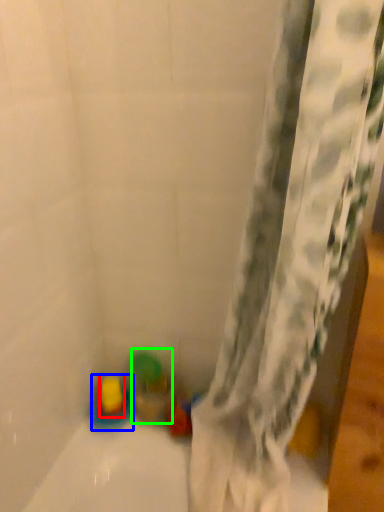
Question: Which is farther away from toy (highlighted by a red box)? toy (highlighted by a blue box) or toy (highlighted by a green box)?

Choices:
 (A) toy
 (B) toy

Answer: (B)